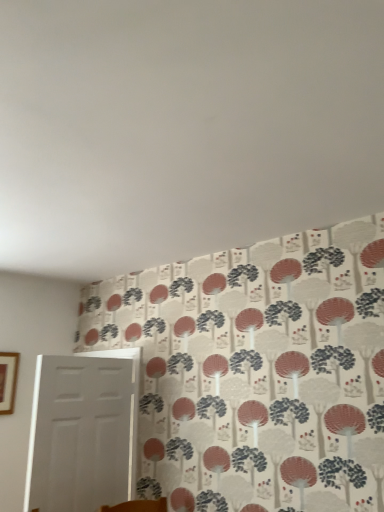
Image resolution: width=384 pixels, height=512 pixels. I want to click on wooden framed picture at left, so click(x=8, y=381).

What do you see at coordinates (8, 381) in the screenshot? The image size is (384, 512). I see `wooden framed picture at left` at bounding box center [8, 381].

This screenshot has height=512, width=384. Identify the location of wooden framed picture at left. (8, 381).